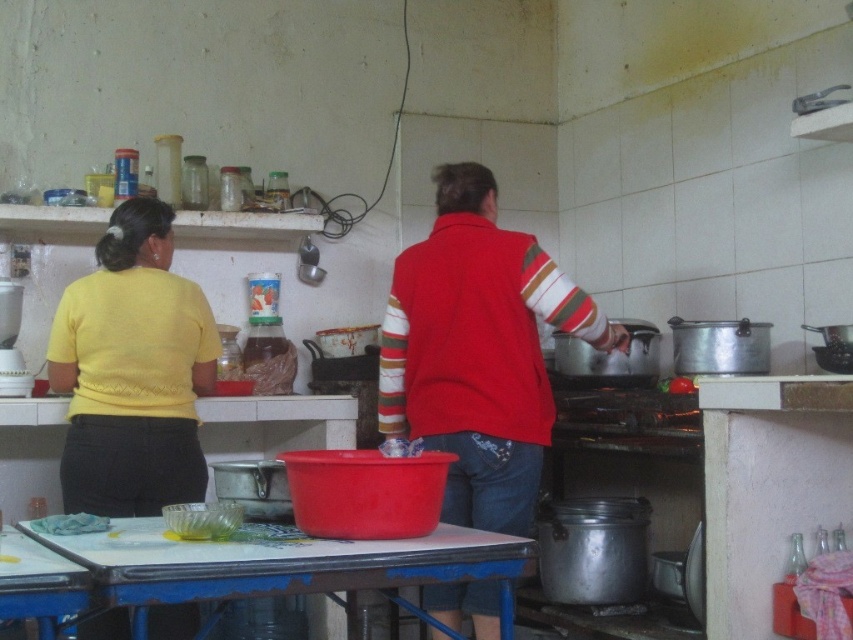
Question: Can you confirm if yellow knitwear at left is thinner than smooth plastic table at center?

Choices:
 (A) no
 (B) yes

Answer: (B)

Question: Does red matte sweater at center have a larger size compared to yellow knitwear at left?

Choices:
 (A) yes
 (B) no

Answer: (A)

Question: Is yellow knitwear at left closer to camera compared to smooth plastic table at center?

Choices:
 (A) no
 (B) yes

Answer: (A)

Question: Based on their relative distances, which object is farther from the smooth plastic table at center?

Choices:
 (A) red matte sweater at center
 (B) yellow knitwear at left

Answer: (B)

Question: Estimate the real-world distances between objects in this image. Which object is farther from the smooth plastic table at center?

Choices:
 (A) red matte sweater at center
 (B) yellow knitwear at left

Answer: (B)

Question: Which point appears farthest from the camera in this image?

Choices:
 (A) (428, 385)
 (B) (171, 625)

Answer: (B)